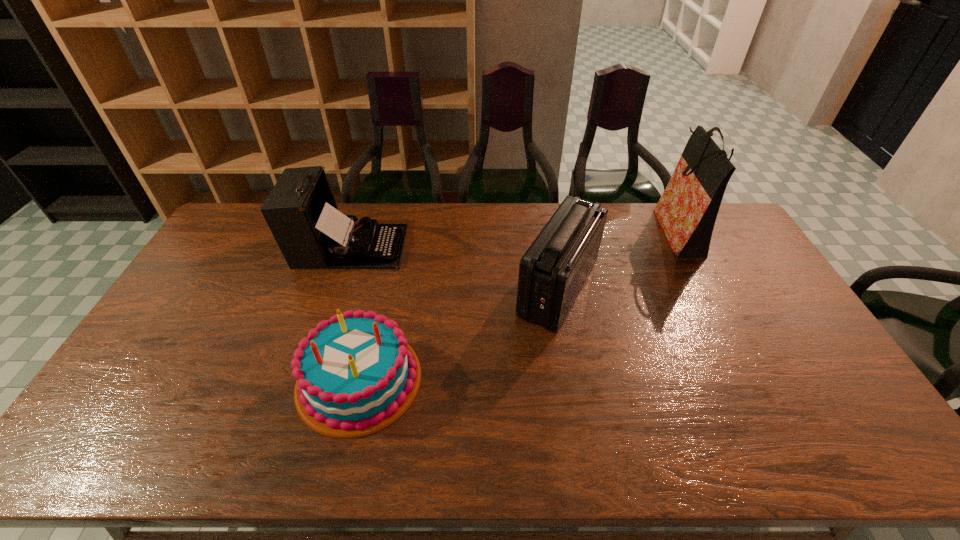
Find the location of a particular element. The width and height of the screenshot is (960, 540). the rightmost object is located at coordinates (687, 210).

Locate an element on the screen. The height and width of the screenshot is (540, 960). the tallest object is located at coordinates (687, 210).

In order to click on typewriter in this screenshot , I will do `click(301, 212)`.

At what (x,y) coordinates should I click in order to perform the action: click on radio receiver. Please return your answer as a coordinate pair (x, y). This screenshot has width=960, height=540. Looking at the image, I should click on (553, 270).

Where is `the shortest object`? The height and width of the screenshot is (540, 960). the shortest object is located at coordinates (355, 373).

Where is `free location located 0.180m on the front side of the tallest object`? This screenshot has width=960, height=540. free location located 0.180m on the front side of the tallest object is located at coordinates (610, 230).

Locate an element on the screen. vacant area situated on the front side of the tallest object is located at coordinates (564, 230).

The height and width of the screenshot is (540, 960). In order to click on vacant space situated on the front side of the tallest object in this screenshot , I will do `click(612, 230)`.

Image resolution: width=960 pixels, height=540 pixels. Identify the location of free point located inside the open case of the typewriter. (472, 246).

You are a GUI agent. You are given a task and a screenshot of the screen. Output one action in this format:
    pyautogui.click(x=<x>, y=<y>)
    Task: Click on the vacant space located on the front panel of the radio receiver
    The height and width of the screenshot is (540, 960).
    Given the screenshot: What is the action you would take?
    pyautogui.click(x=436, y=289)